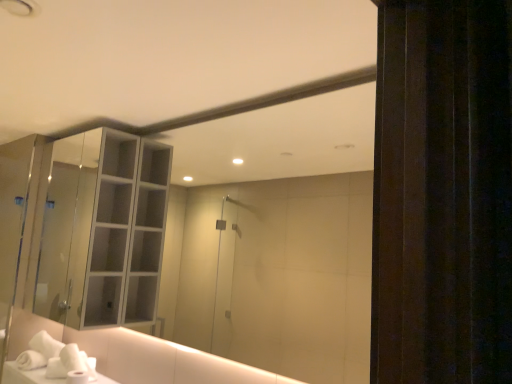
Question: Is white soft hand towel at lower left facing towards clear glass cabinet at upper left?

Choices:
 (A) no
 (B) yes

Answer: (A)

Question: Is white soft hand towel at lower left not near clear glass cabinet at upper left?

Choices:
 (A) no
 (B) yes

Answer: (A)

Question: From a real-world perspective, is white soft hand towel at lower left below clear glass cabinet at upper left?

Choices:
 (A) no
 (B) yes

Answer: (B)

Question: Does white soft hand towel at lower left have a lesser width compared to clear glass cabinet at upper left?

Choices:
 (A) no
 (B) yes

Answer: (B)

Question: From the image's perspective, is white soft hand towel at lower left above clear glass cabinet at upper left?

Choices:
 (A) yes
 (B) no

Answer: (B)

Question: Is white soft hand towel at lower left smaller than clear glass cabinet at upper left?

Choices:
 (A) yes
 (B) no

Answer: (A)

Question: From a real-world perspective, does clear glass cabinet at upper left sit lower than white soft hand towel at lower left?

Choices:
 (A) yes
 (B) no

Answer: (B)

Question: Is clear glass cabinet at upper left closer to the viewer compared to white soft hand towel at lower left?

Choices:
 (A) no
 (B) yes

Answer: (B)

Question: Considering the relative sizes of clear glass cabinet at upper left and white soft hand towel at lower left in the image provided, is clear glass cabinet at upper left taller than white soft hand towel at lower left?

Choices:
 (A) yes
 (B) no

Answer: (A)

Question: Can you confirm if clear glass cabinet at upper left is bigger than white soft hand towel at lower left?

Choices:
 (A) yes
 (B) no

Answer: (A)

Question: Does clear glass cabinet at upper left have a lesser height compared to white soft hand towel at lower left?

Choices:
 (A) no
 (B) yes

Answer: (A)

Question: From the image's perspective, is clear glass cabinet at upper left on top of white soft hand towel at lower left?

Choices:
 (A) yes
 (B) no

Answer: (A)

Question: Visually, is clear glass cabinet at upper left positioned to the left or to the right of white soft hand towel at lower left?

Choices:
 (A) left
 (B) right

Answer: (A)